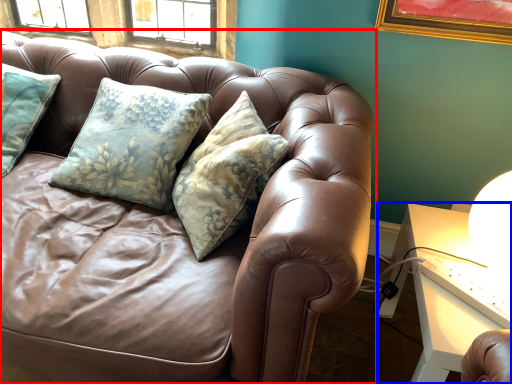
Question: Which object is closer to the camera taking this photo, studio couch (highlighted by a red box) or table (highlighted by a blue box)?

Choices:
 (A) studio couch
 (B) table

Answer: (A)